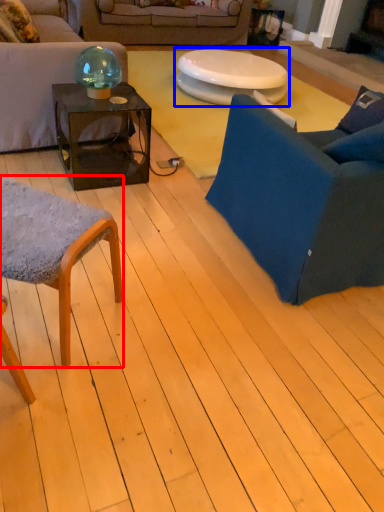
Question: Which of the following is the closest to the observer, chair (highlighted by a red box) or table (highlighted by a blue box)?

Choices:
 (A) chair
 (B) table

Answer: (A)